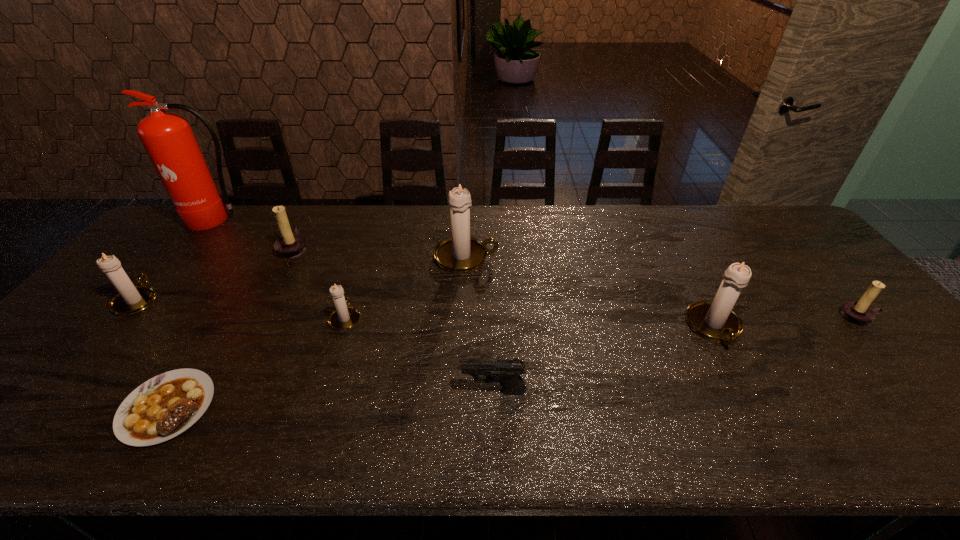
The height and width of the screenshot is (540, 960). I want to click on red fire extinguisher, so click(168, 139).

At what (x,y) coordinates should I click in order to perform the action: click on the farthest object. Please return your answer as a coordinate pair (x, y). This screenshot has width=960, height=540. Looking at the image, I should click on (168, 139).

This screenshot has width=960, height=540. I want to click on the second tallest object, so click(x=460, y=253).

Where is `the third white candle holder from left to right`? the third white candle holder from left to right is located at coordinates (460, 253).

You are a GUI agent. You are given a task and a screenshot of the screen. Output one action in this format:
    pyautogui.click(x=<x>, y=<y>)
    Task: Click on the third tallest object
    
    Given the screenshot: What is the action you would take?
    [715, 320]

The height and width of the screenshot is (540, 960). What are the coordinates of `the rightmost white candle holder` in the screenshot? It's located at (715, 320).

Identify the location of the bigger brown candle holder. The width and height of the screenshot is (960, 540). (290, 245).

The height and width of the screenshot is (540, 960). I want to click on the second candle holder from left to right, so click(290, 245).

Where is `the third biggest white candle holder`? This screenshot has width=960, height=540. the third biggest white candle holder is located at coordinates (131, 299).

Where is `the leftmost candle holder`? The width and height of the screenshot is (960, 540). the leftmost candle holder is located at coordinates (131, 299).